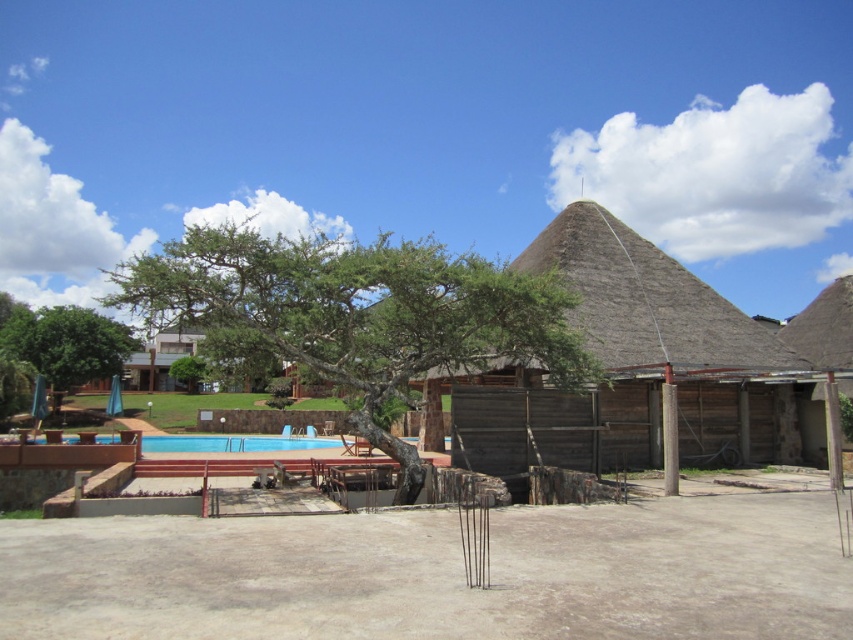
Question: Which of the following is the farthest from the observer?

Choices:
 (A) thatched straw roof at upper right
 (B) thatched wood hut at center

Answer: (A)

Question: Can you confirm if thatched wood hut at center is positioned below thatched straw roof at upper right?

Choices:
 (A) yes
 (B) no

Answer: (A)

Question: Which point appears farthest from the camera in this image?

Choices:
 (A) (692, 289)
 (B) (839, 336)
 (C) (100, 339)
 (D) (354, 388)

Answer: (C)

Question: Is thatched wood hut at center to the right of green leafy tree at left from the viewer's perspective?

Choices:
 (A) yes
 (B) no

Answer: (A)

Question: Which point is farther to the camera?

Choices:
 (A) (804, 342)
 (B) (390, 444)
 (C) (65, 381)

Answer: (C)

Question: Is green leafy tree at center to the right of thatched straw roof at upper right from the viewer's perspective?

Choices:
 (A) no
 (B) yes

Answer: (A)